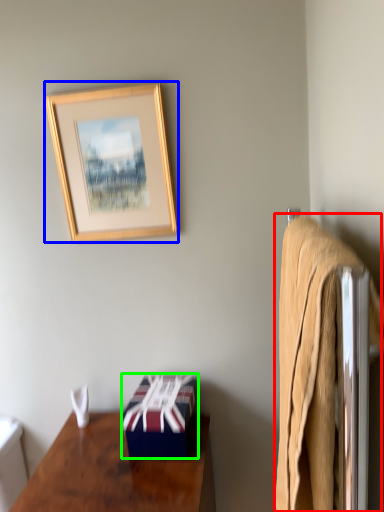
Question: Which object is positioned closest to bath towel (highlighted by a red box)? Select from picture frame (highlighted by a blue box) and box (highlighted by a green box).

Choices:
 (A) picture frame
 (B) box

Answer: (B)